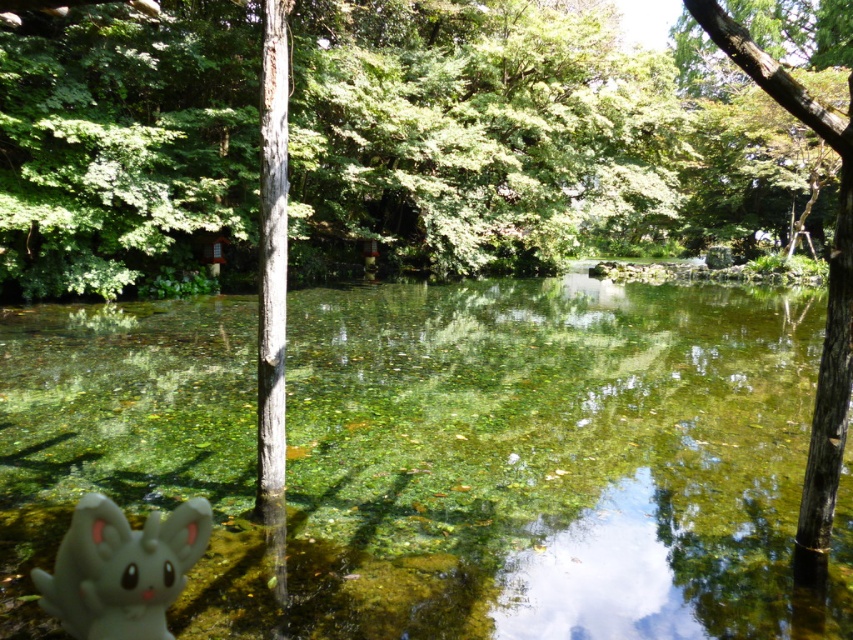
Question: Which object appears closest to the camera in this image?

Choices:
 (A) smooth bark tree at right
 (B) clear glass water at center

Answer: (A)

Question: Considering the relative positions of clear glass water at center and white rubber toy at lower left in the image provided, where is clear glass water at center located with respect to white rubber toy at lower left?

Choices:
 (A) below
 (B) above

Answer: (B)

Question: Can you confirm if clear glass water at center is thinner than white rubber toy at lower left?

Choices:
 (A) no
 (B) yes

Answer: (A)

Question: Is clear glass water at center to the right of smooth bark tree at right from the viewer's perspective?

Choices:
 (A) yes
 (B) no

Answer: (B)

Question: Which point appears farthest from the camera in this image?

Choices:
 (A) (115, 584)
 (B) (659, 332)
 (C) (850, 160)

Answer: (B)

Question: Which point appears closest to the camera in this image?

Choices:
 (A) click(86, 429)
 (B) click(77, 632)

Answer: (B)